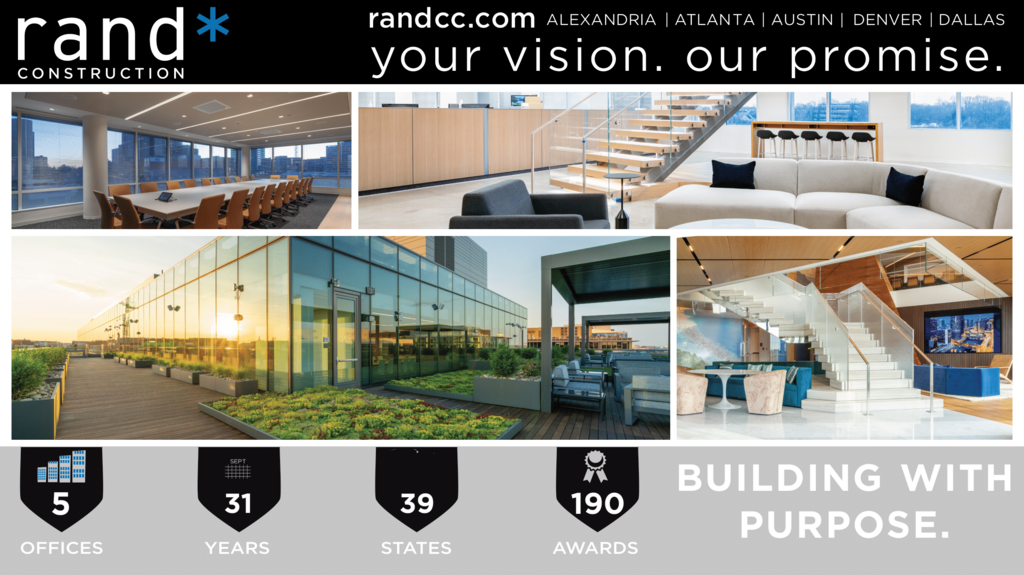
Find the location of a particular element. The width and height of the screenshot is (1024, 575). office chairs is located at coordinates (196, 217), (243, 210), (282, 196), (299, 191), (219, 177), (175, 184), (122, 189).